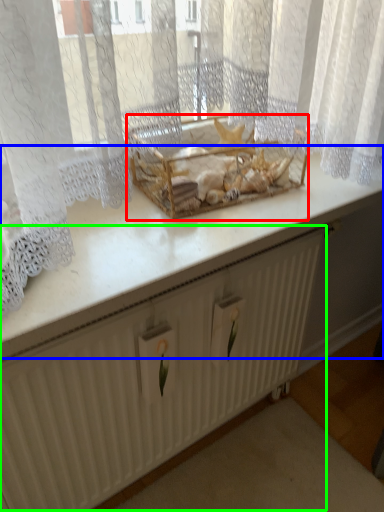
Question: Based on their relative distances, which object is nearer to crate (highlighted by a red box)? Choose from counter top (highlighted by a blue box) and radiator (highlighted by a green box).

Choices:
 (A) counter top
 (B) radiator

Answer: (A)